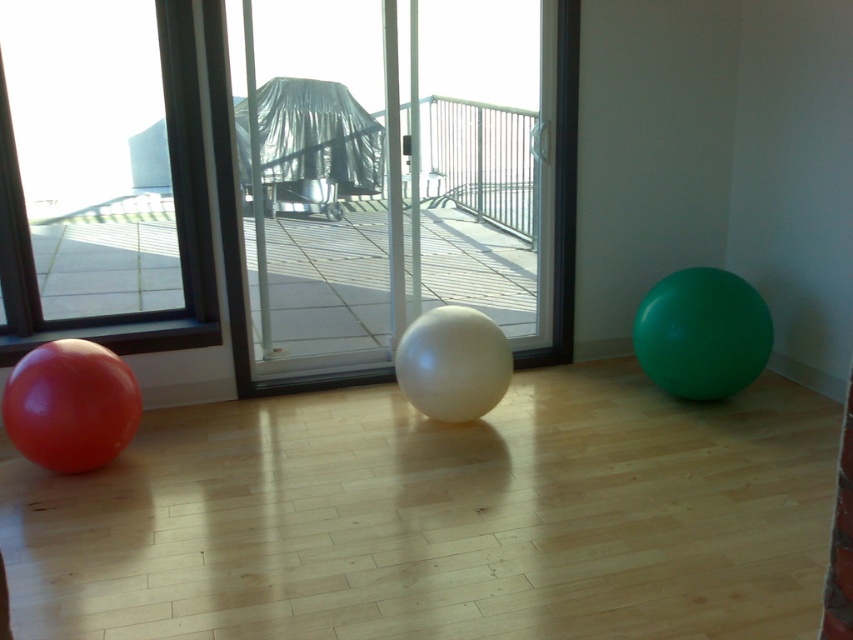
Question: Is transparent plastic screen door at center positioned behind green rubber ball at right?

Choices:
 (A) yes
 (B) no

Answer: (B)

Question: Which point appears farthest from the camera in this image?

Choices:
 (A) (332, 157)
 (B) (39, 356)

Answer: (A)

Question: Is transparent plastic screen door at center above white glossy ball at center?

Choices:
 (A) yes
 (B) no

Answer: (A)

Question: Considering the real-world distances, which object is farthest from the metallic silver rail at center?

Choices:
 (A) transparent plastic screen door at center
 (B) white glossy ball at center

Answer: (B)

Question: Which point is farther to the camera?

Choices:
 (A) (488, 369)
 (B) (138, 419)
 (C) (260, 346)
 (D) (701, 396)

Answer: (C)

Question: Observing the image, what is the correct spatial positioning of transparent plastic screen door at center in reference to matte red balloon at left?

Choices:
 (A) above
 (B) below

Answer: (A)